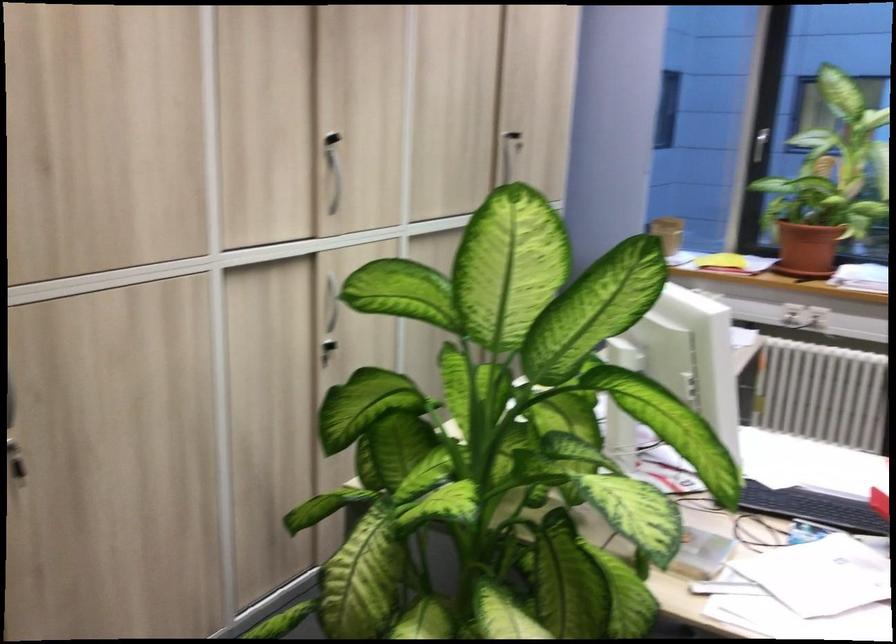
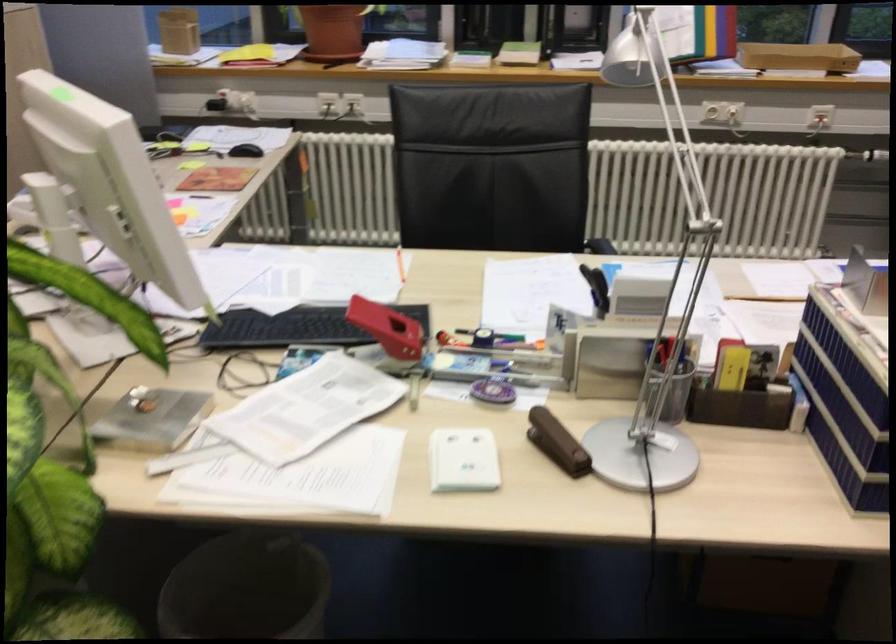
In the second image, find the point that corresponds to point (800, 249) in the first image.

(332, 31)